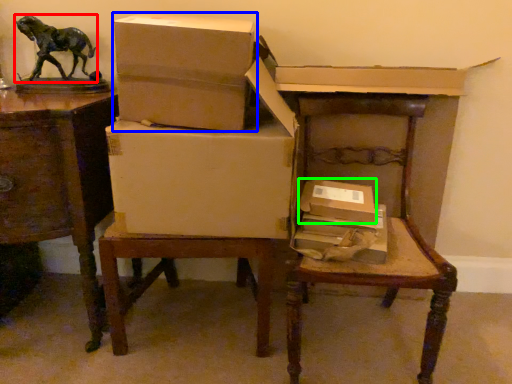
Question: Which object is the farthest from animal (highlighted by a red box)? Choose among these: box (highlighted by a blue box) or box (highlighted by a green box).

Choices:
 (A) box
 (B) box

Answer: (B)